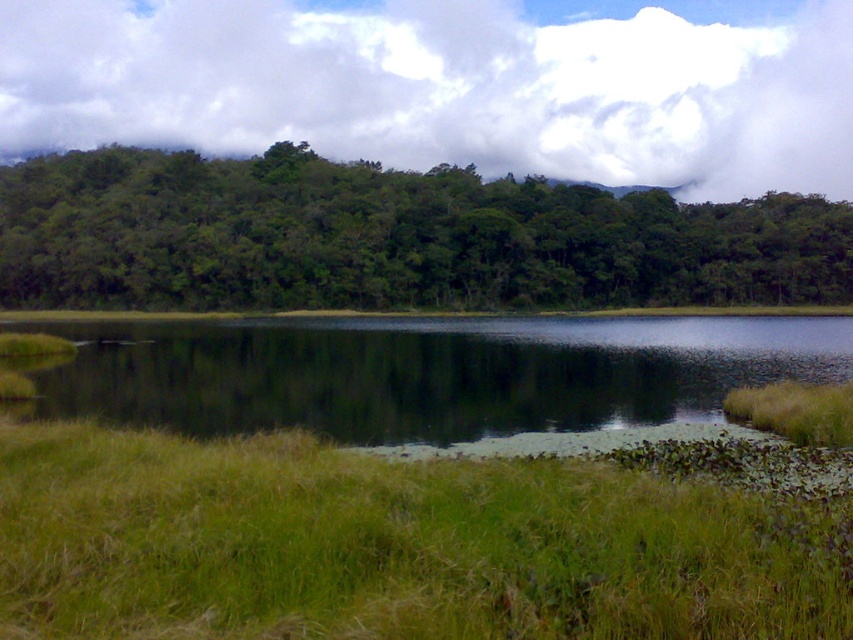
You are standing at the center of the grassy area in the foreground of the serene natural landscape. You want to walk to the green leafy trees at upper center located at point (392, 237). Which direction should you head?

You should head north towards the green leafy trees at upper center located at point (392, 237) since they are positioned at the upper center of the image, indicating a northerly direction from your current position in the foreground.

You are standing in the serene natural landscape and want to walk from the point closer to you to the point further away. Which path should you take between the two points, point (277, 49) and point (796, 346)?

You should walk from point (277, 49) to point (796, 346) because point (277, 49) is closer to you, and point (796, 346) is further away.

You are an artist trying to paint the scene. You want to ensure the white fluffy cloud at upper center and the green grassy lake at center are proportionally accurate. Which object should you paint larger in your artwork?

The white fluffy cloud at upper center should be painted larger than the green grassy lake at center because it has a larger size compared to the green grassy lake at center according to the description.